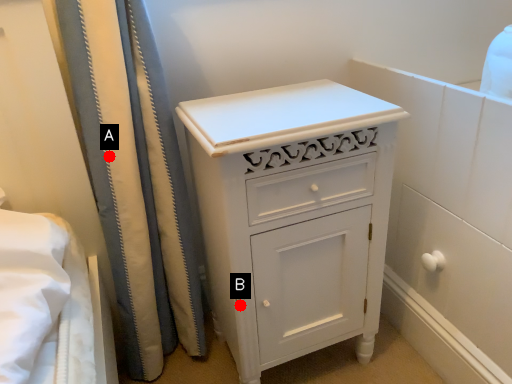
Question: Two points are circled on the image, labeled by A and B beside each circle. Which point is farther to the camera?

Choices:
 (A) A is further
 (B) B is further

Answer: (A)